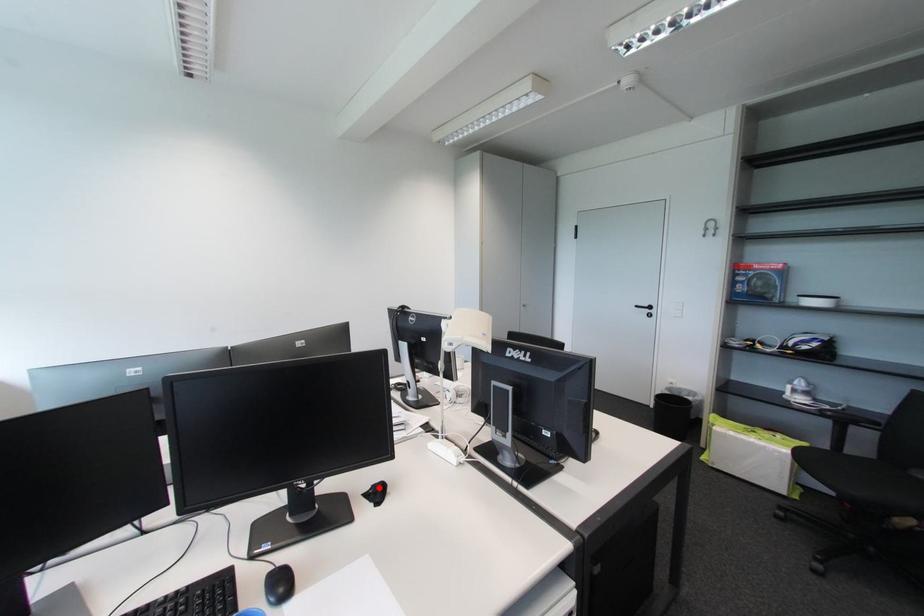
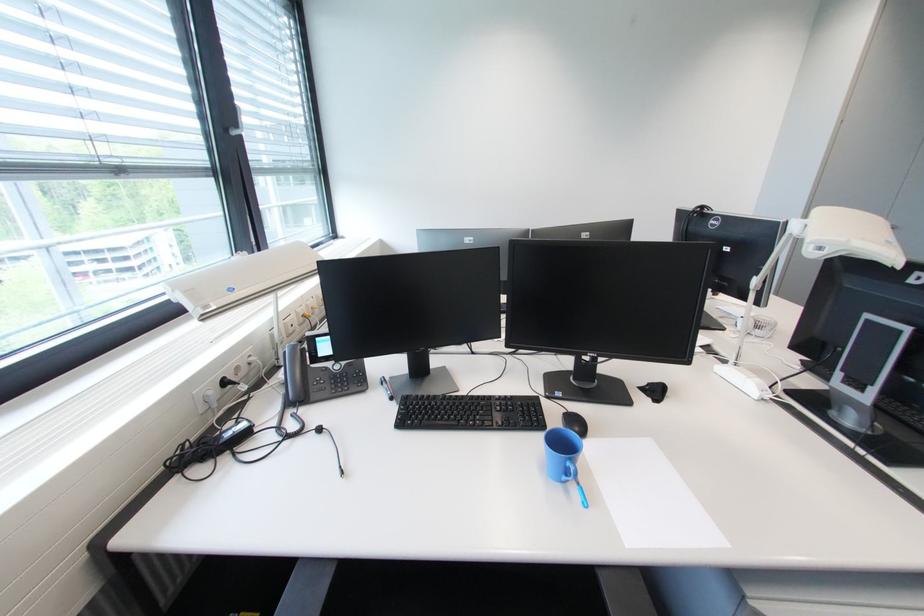
Question: I am providing you with two images of the same scene from different viewpoints. Image1 has a red point marked. In image2, the corresponding 3D location appears at what relative position? Reply with the corresponding letter.

Choices:
 (A) Closer
 (B) Farther

Answer: (A)